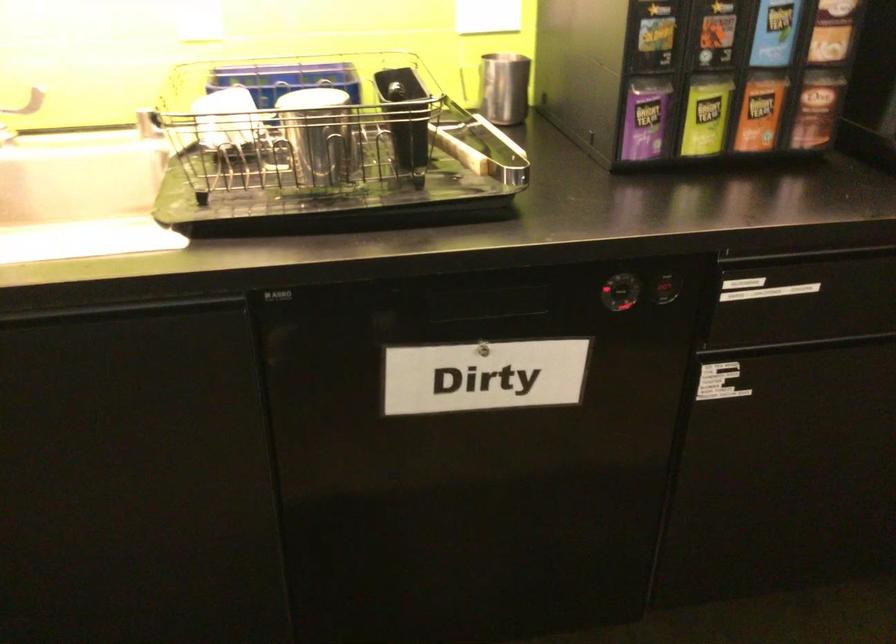
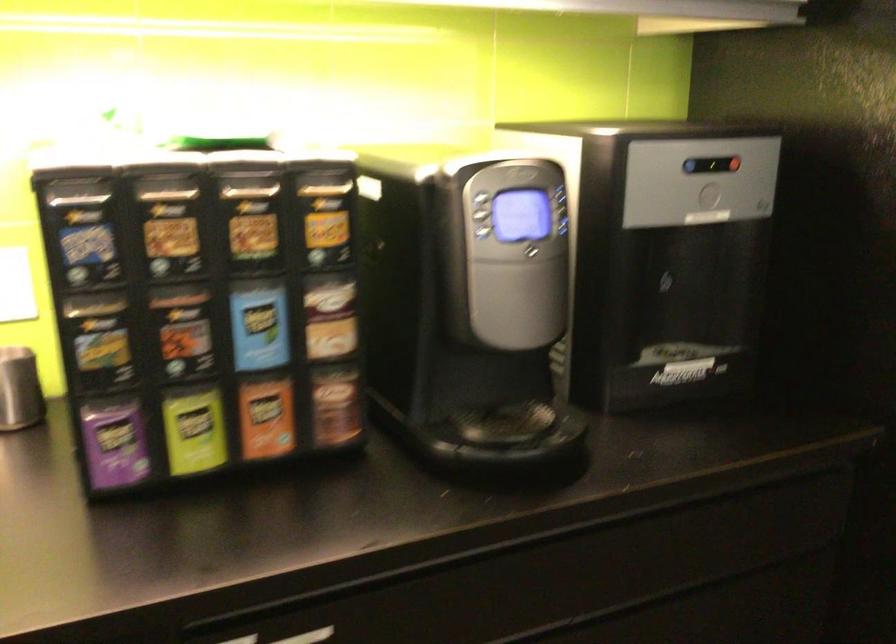
Where in the second image is the point corresponding to the point at 819,109 from the first image?

(336, 406)